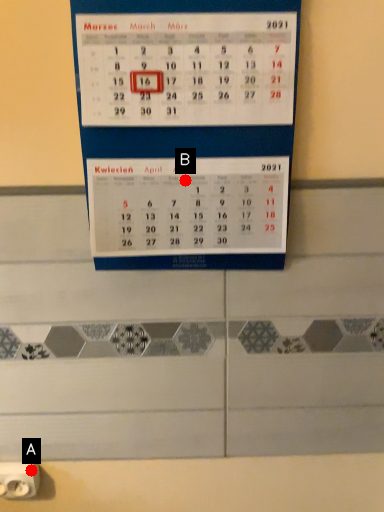
Question: Two points are circled on the image, labeled by A and B beside each circle. Which point appears closest to the camera in this image?

Choices:
 (A) A is closer
 (B) B is closer

Answer: (B)